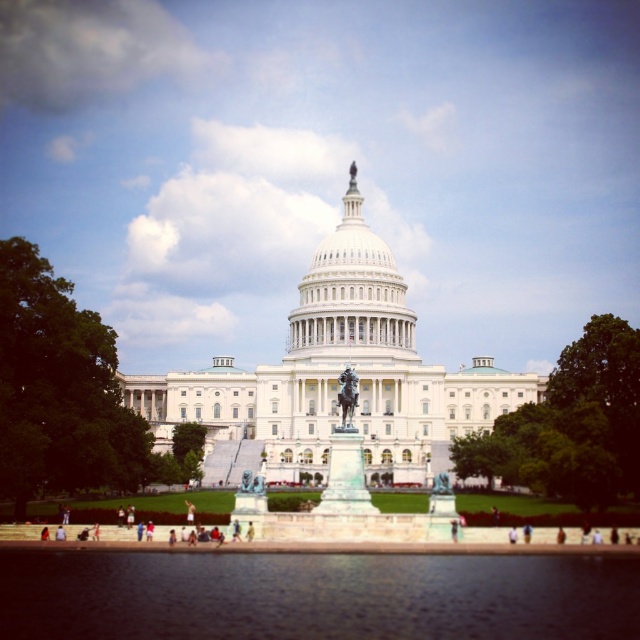
Between white marble dome at center and green leafy tree at center, which one appears on the left side from the viewer's perspective?

Positioned to the left is green leafy tree at center.

Is white marble dome at center smaller than green leafy tree at center?

No, white marble dome at center is not smaller than green leafy tree at center.

I want to click on white marble dome at center, so click(x=352, y=296).

Is green leafy tree at left bigger than white cotton shirt at center?

Correct, green leafy tree at left is larger in size than white cotton shirt at center.

You are a GUI agent. You are given a task and a screenshot of the screen. Output one action in this format:
    pyautogui.click(x=<x>, y=<y>)
    Task: Click on the green leafy tree at left
    The image size is (640, 640).
    Given the screenshot: What is the action you would take?
    pyautogui.click(x=60, y=388)

Is point (72, 348) in front of point (515, 538)?

That is False.

You are a GUI agent. You are given a task and a screenshot of the screen. Output one action in this format:
    pyautogui.click(x=<x>, y=<y>)
    Task: Click on the green leafy tree at left
    The width and height of the screenshot is (640, 640).
    Given the screenshot: What is the action you would take?
    pyautogui.click(x=60, y=388)

Who is higher up, green leafy tree at left or white marble dome at center?

Positioned higher is white marble dome at center.

Can you confirm if green leafy tree at left is smaller than white marble dome at center?

Indeed, green leafy tree at left has a smaller size compared to white marble dome at center.

This screenshot has width=640, height=640. In order to click on green leafy tree at left in this screenshot , I will do `click(60, 388)`.